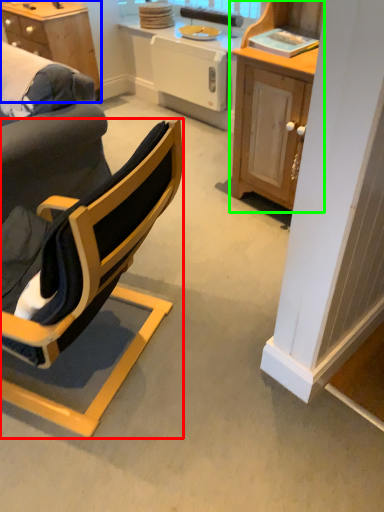
Question: Based on their relative distances, which object is nearer to chair (highlighted by a red box)? Choose from desk (highlighted by a blue box) and cabinetry (highlighted by a green box).

Choices:
 (A) desk
 (B) cabinetry

Answer: (B)